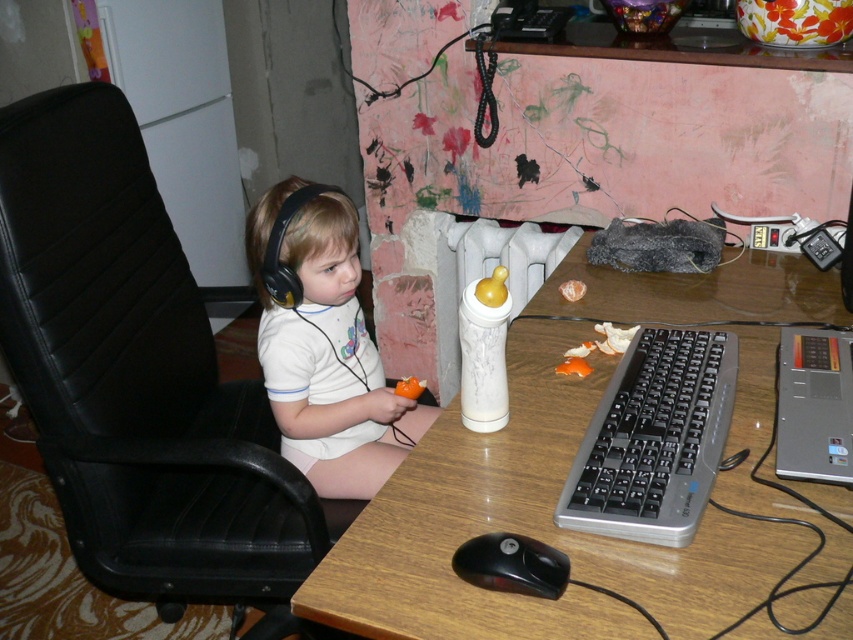
Question: Does matte white shirt at center appear over black matte earphone at left?

Choices:
 (A) no
 (B) yes

Answer: (A)

Question: Estimate the real-world distances between objects in this image. Which object is closer to the black leather chair at left?

Choices:
 (A) black matte earphone at left
 (B) white plastic bottle at center
 (C) matte white shirt at center
 (D) black plastic mouse at lower center

Answer: (C)

Question: Can you confirm if black leather chair at left is positioned to the left of matte white shirt at center?

Choices:
 (A) no
 (B) yes

Answer: (B)

Question: Is black leather chair at left to the right of black plastic keyboard at right from the viewer's perspective?

Choices:
 (A) yes
 (B) no

Answer: (B)

Question: Among these points, which one is nearest to the camera?

Choices:
 (A) (357, 392)
 (B) (428, 630)
 (C) (500, 544)

Answer: (B)

Question: Which is nearer to the white plastic bottle at center?

Choices:
 (A) matte white shirt at center
 (B) black plastic keyboard at right

Answer: (B)